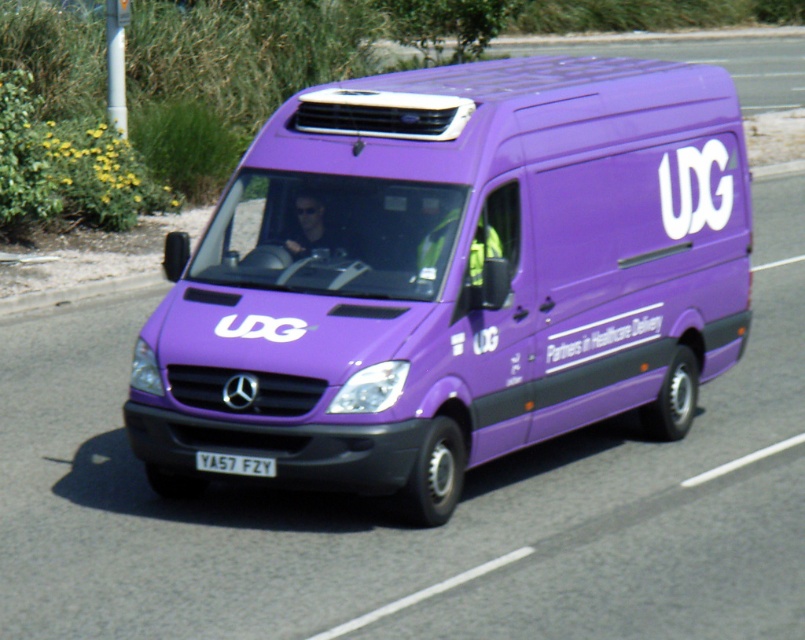
Which is in front, point (704, 310) or point (213, 470)?

Point (213, 470)

Based on the photo, between purple matte van at center and white plastic license plate at center, which one has more height?

purple matte van at center is taller.

Is point (448, 456) positioned behind point (238, 474)?

That is True.

I want to click on purple matte van at center, so click(452, 276).